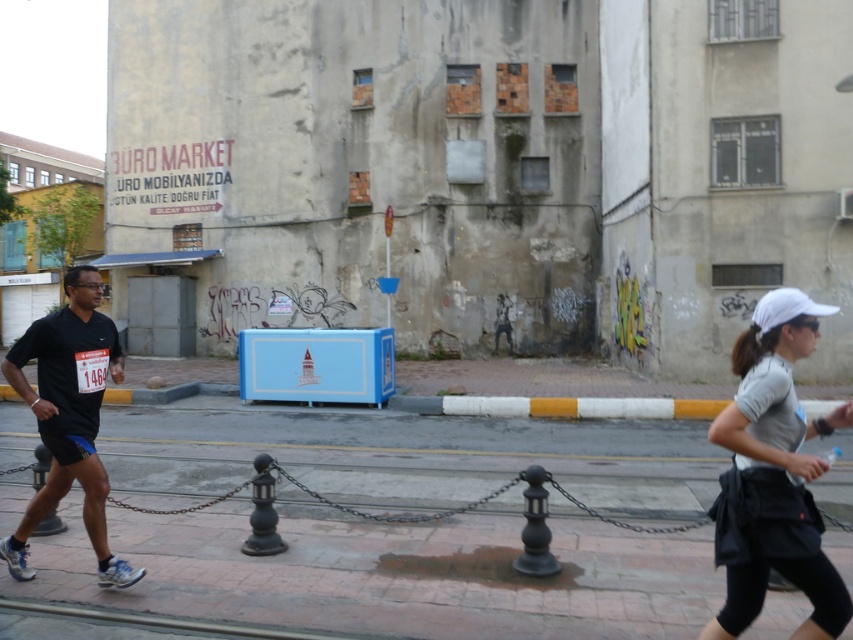
The height and width of the screenshot is (640, 853). What do you see at coordinates (393, 572) in the screenshot?
I see `brick pavement at lower center` at bounding box center [393, 572].

Is point (22, 499) positioned behind point (42, 397)?

Yes, point (22, 499) is farther from viewer.

Is point (409, 444) farther from camera compared to point (67, 480)?

Yes, point (409, 444) is behind point (67, 480).

Locate an element on the screen. Image resolution: width=853 pixels, height=640 pixels. brick pavement at lower center is located at coordinates (393, 572).

Who is taller, white matte running outfit at right or black matte shirt at left?

white matte running outfit at right

Is point (801, 433) positioned in front of point (83, 454)?

Yes, point (801, 433) is in front of point (83, 454).

At what (x,y) coordinates should I click in order to perform the action: click on white matte running outfit at right. Please return your answer as a coordinate pair (x, y). The width and height of the screenshot is (853, 640). Looking at the image, I should click on (776, 468).

Is point (456, 451) less distant than point (822, 584)?

No.

Is brick pavement at lower center to the left of white matte running outfit at right from the viewer's perspective?

Indeed, brick pavement at lower center is positioned on the left side of white matte running outfit at right.

Is point (370, 449) behind point (820, 461)?

Yes, it is.

The height and width of the screenshot is (640, 853). Find the location of `brick pavement at lower center`. brick pavement at lower center is located at coordinates (393, 572).